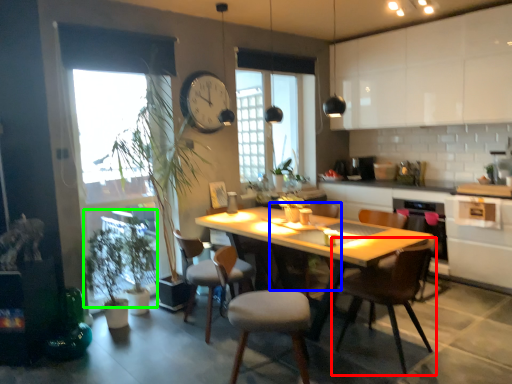
Question: Which object is the closest to the chair (highlighted by a red box)? Choose among these: chair (highlighted by a blue box) or plant (highlighted by a green box).

Choices:
 (A) chair
 (B) plant

Answer: (B)